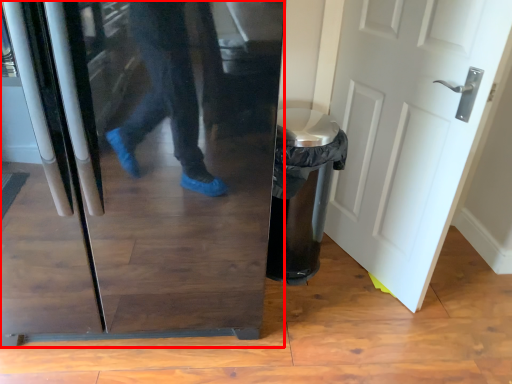
Question: Where is refrigerator (annotated by the red box) located in relation to door in the image?

Choices:
 (A) right
 (B) left

Answer: (B)